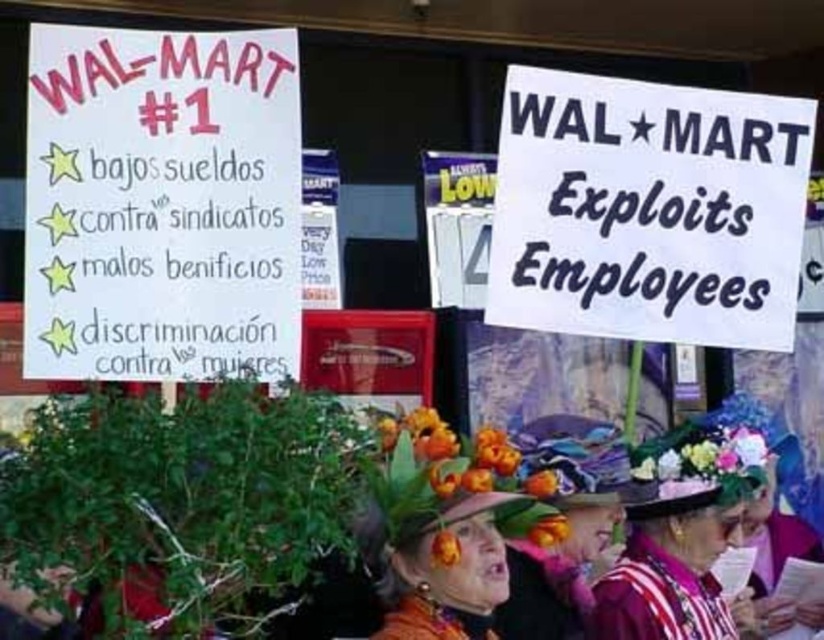
You are a photographer trying to capture both the floral fabric hat at center and the floral hat at center in a single frame. Which hat should you position closer to the camera to ensure both fit within the frame?

The floral fabric hat at center has a lesser width compared to the floral hat at center. Position the wider floral hat at center closer to the camera to accommodate its larger size within the frame.